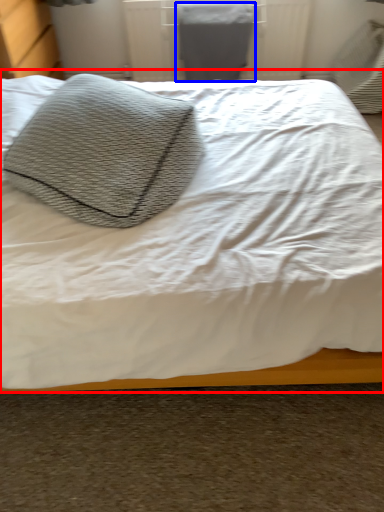
Question: Which object is closer to the camera taking this photo, bed (highlighted by a red box) or gray (highlighted by a blue box)?

Choices:
 (A) bed
 (B) gray

Answer: (A)